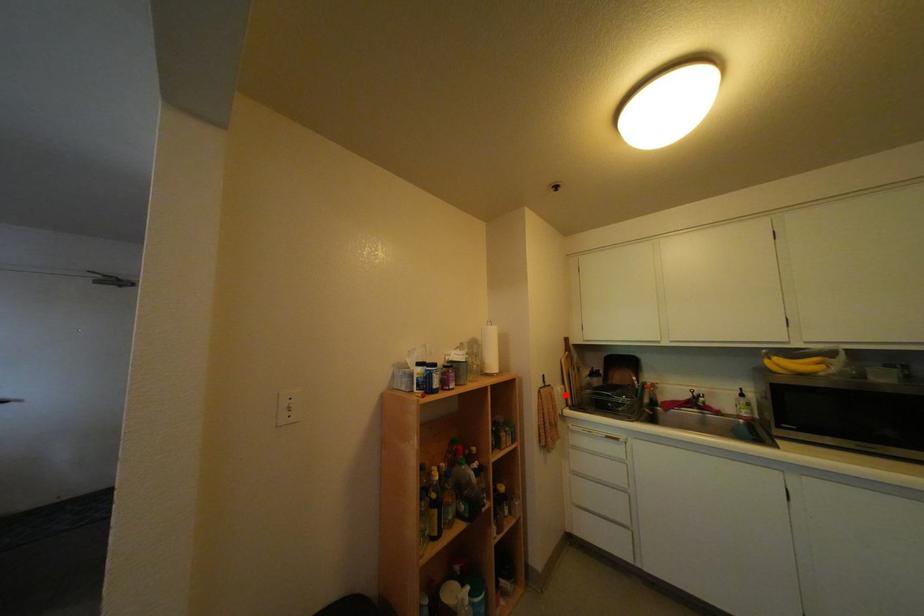
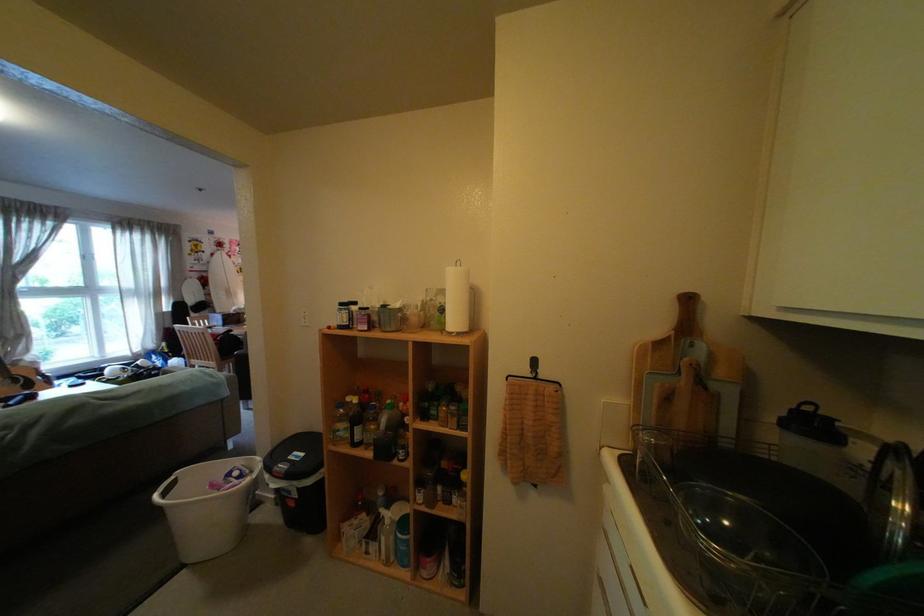
Locate, in the second image, the point that corresponds to the highlighted location in the first image.

(558, 398)